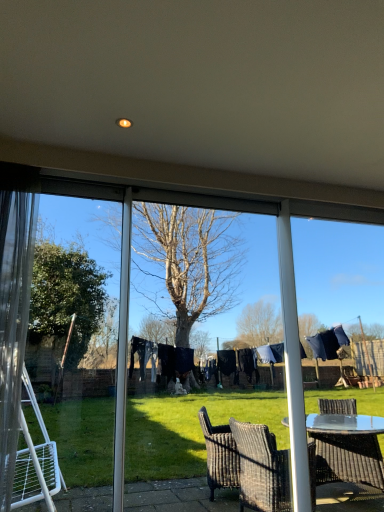
Question: Should I look upward or downward to see clear glass window frame at right?

Choices:
 (A) down
 (B) up

Answer: (A)

Question: From the image's perspective, is transparent plastic screen door at center, the second screen door viewed from the left, under clear glass window frame at right?

Choices:
 (A) yes
 (B) no

Answer: (B)

Question: Is transparent plastic screen door at center, the second screen door viewed from the left, to the left of clear glass window frame at right from the viewer's perspective?

Choices:
 (A) yes
 (B) no

Answer: (A)

Question: Does transparent plastic screen door at center, which ranks as the 1th screen door in right-to-left order, have a lesser width compared to clear glass window frame at right?

Choices:
 (A) no
 (B) yes

Answer: (B)

Question: Is transparent plastic screen door at center, which ranks as the 1th screen door in right-to-left order, at the right side of clear glass window frame at right?

Choices:
 (A) yes
 (B) no

Answer: (B)

Question: Does transparent plastic screen door at center, which ranks as the 1th screen door in right-to-left order, contain clear glass window frame at right?

Choices:
 (A) yes
 (B) no

Answer: (B)

Question: Is transparent plastic screen door at center, the second screen door viewed from the left, directly adjacent to clear glass window frame at right?

Choices:
 (A) yes
 (B) no

Answer: (B)

Question: Does transparent glass screen door at left, the second screen door from the right, have a lesser width compared to transparent plastic screen door at center, which ranks as the 1th screen door in right-to-left order?

Choices:
 (A) no
 (B) yes

Answer: (B)

Question: Is transparent glass screen door at left, the second screen door from the right, smaller than transparent plastic screen door at center, which ranks as the 1th screen door in right-to-left order?

Choices:
 (A) yes
 (B) no

Answer: (A)

Question: Would you say transparent glass screen door at left, which ranks as the first screen door in left-to-right order, is a long distance from transparent plastic screen door at center, the second screen door viewed from the left?

Choices:
 (A) yes
 (B) no

Answer: (A)

Question: Is transparent glass screen door at left, the second screen door from the right, facing away from transparent plastic screen door at center, the second screen door viewed from the left?

Choices:
 (A) no
 (B) yes

Answer: (A)

Question: Does transparent glass screen door at left, the second screen door from the right, have a greater width compared to transparent plastic screen door at center, the second screen door viewed from the left?

Choices:
 (A) no
 (B) yes

Answer: (A)

Question: From a real-world perspective, is transparent glass screen door at left, which ranks as the first screen door in left-to-right order, positioned under transparent plastic screen door at center, which ranks as the 1th screen door in right-to-left order, based on gravity?

Choices:
 (A) yes
 (B) no

Answer: (B)

Question: From a real-world perspective, is transparent plastic screen door at center, which ranks as the 1th screen door in right-to-left order, under transparent glass screen door at left, the second screen door from the right?

Choices:
 (A) yes
 (B) no

Answer: (A)